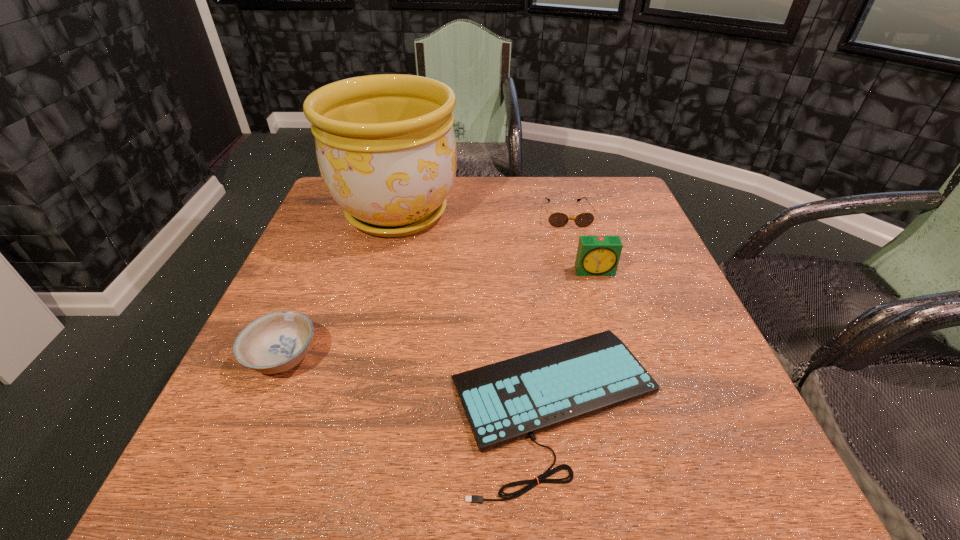
Find the location of `object at the far right corner`. object at the far right corner is located at coordinates (557, 219).

Find the location of a particular element. object at the near right corner is located at coordinates (506, 401).

Locate an element on the screen. vacant space at the far edge of the desktop is located at coordinates (521, 191).

Identify the location of vacant space at the near edge of the desktop. This screenshot has height=540, width=960. (421, 477).

In the image, there is a desktop. Where is `vacant space at the left edge`? vacant space at the left edge is located at coordinates (325, 240).

Find the location of a particular element. vacant region at the right edge of the desktop is located at coordinates (612, 289).

You are a GUI agent. You are given a task and a screenshot of the screen. Output one action in this format:
    pyautogui.click(x=<x>, y=<y>)
    Task: Click on the vacant region at the near left corner of the desktop
    
    Given the screenshot: What is the action you would take?
    pyautogui.click(x=222, y=450)

You are a GUI agent. You are given a task and a screenshot of the screen. Output one action in this format:
    pyautogui.click(x=<x>, y=<y>)
    Task: Click on the vacant space at the far right corner
    The width and height of the screenshot is (960, 540).
    Given the screenshot: What is the action you would take?
    pyautogui.click(x=612, y=192)

This screenshot has height=540, width=960. In order to click on vacant space at the near right corner of the desktop in this screenshot , I will do `click(708, 468)`.

Locate an element on the screen. This screenshot has width=960, height=540. vacant space that's between the sunglasses and the computer keyboard is located at coordinates click(x=561, y=309).